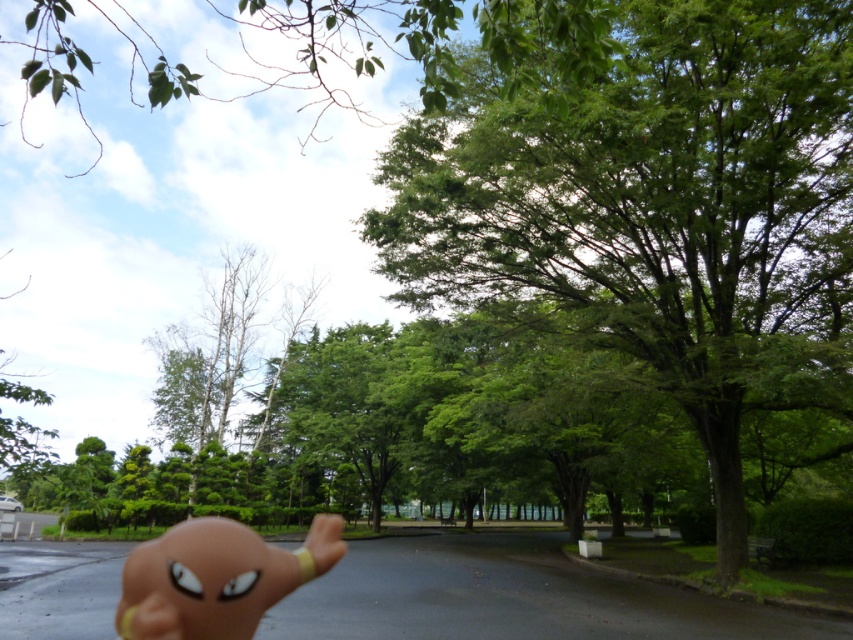
Is green leafy tree at center positioned in front of matte plastic toy at lower center?

No, it is not.

Which is behind, point (726, 221) or point (238, 529)?

Positioned behind is point (726, 221).

Identify the location of green leafy tree at center. (659, 212).